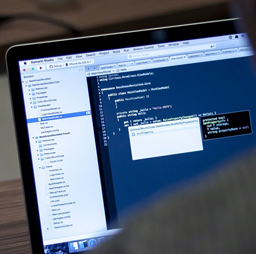
I want to click on wood table or desk, so click(16, 222).